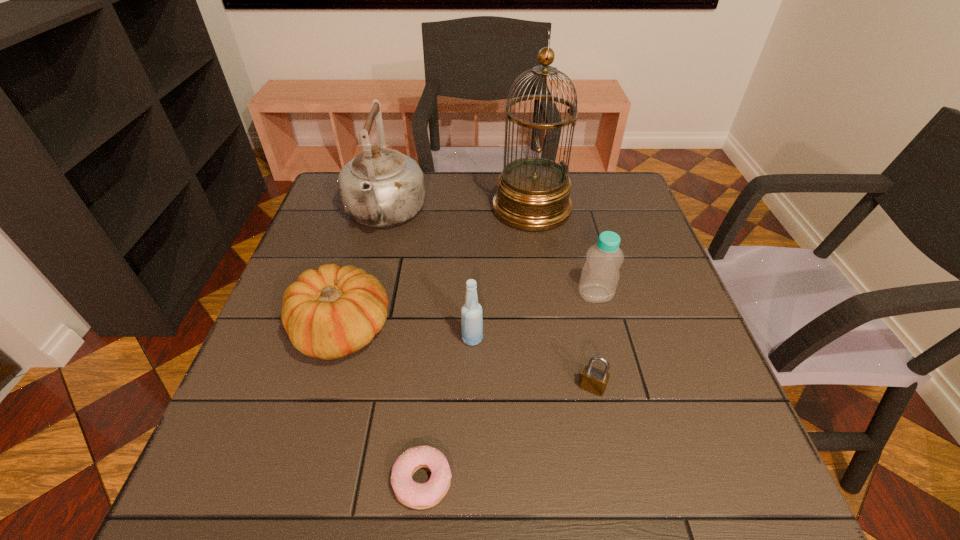
Find the location of a particular element. free spot that satisfies the following two spatial constraints: 1. with an open door on the sixth farthest object; 2. on the left side of the birdcage is located at coordinates (558, 387).

At what (x,y) coordinates should I click in order to perform the action: click on vacant region that satisfies the following two spatial constraints: 1. with an open door on the tallest object; 2. at the spout of the second tallest object. Please return your answer as a coordinate pair (x, y). This screenshot has width=960, height=540. Looking at the image, I should click on (533, 214).